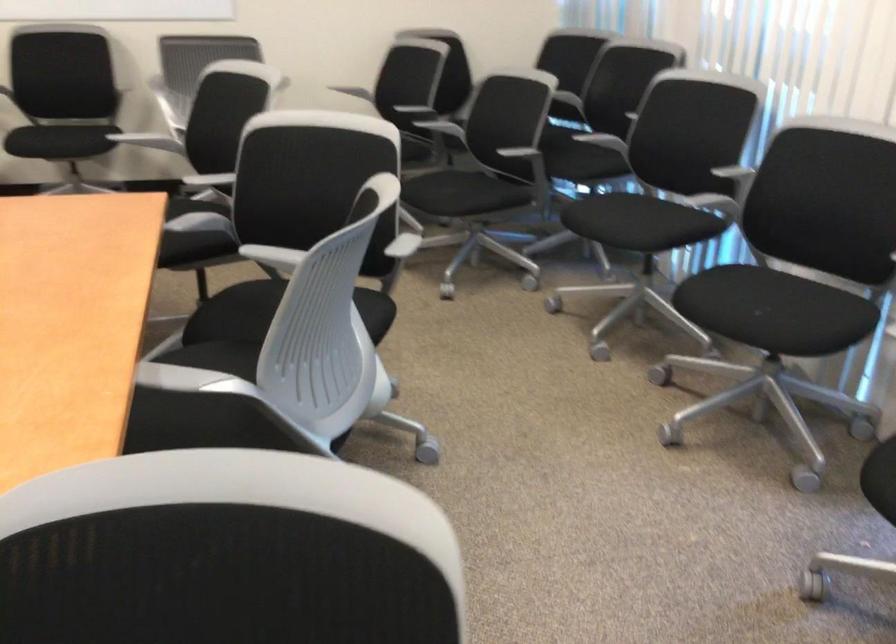
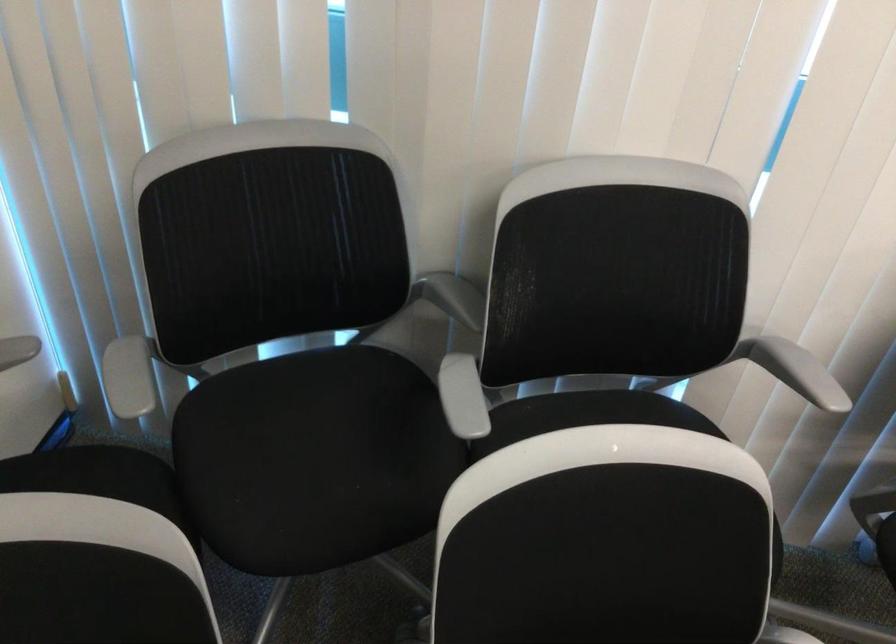
Where in the second image is the point corresponding to pixel 643 108 from the first image?

(794, 370)